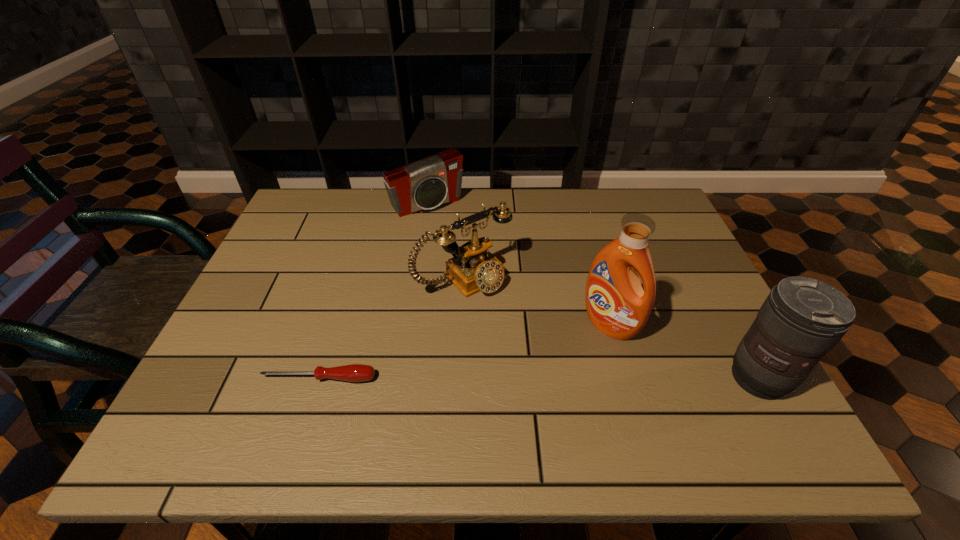
At what (x,y) coordinates should I click in order to perform the action: click on blank space that satisfies the following two spatial constraints: 1. on the front side of the rightmost object; 2. on the side of the farthest object where the control switches are located. Please return your answer as a coordinate pair (x, y). Looking at the image, I should click on (399, 378).